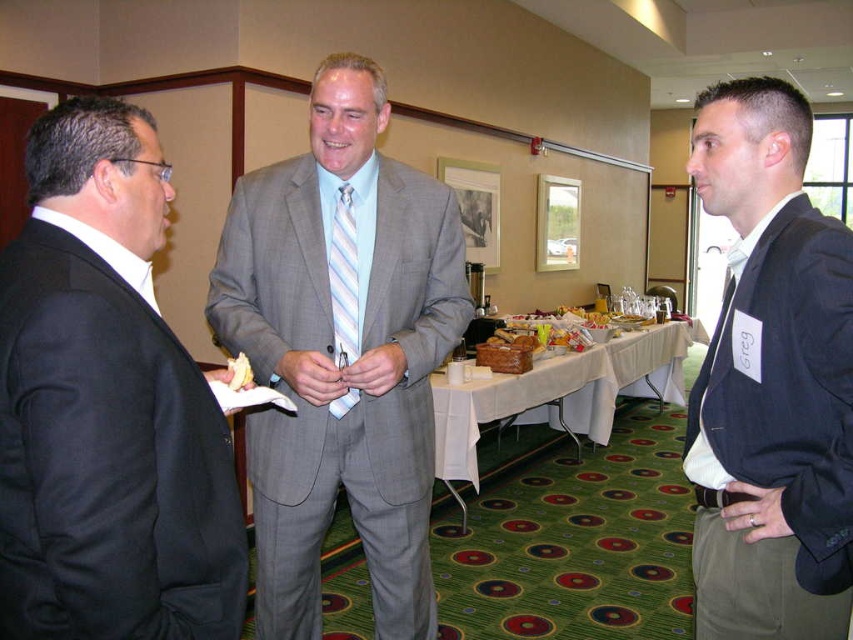
You are at a networking event and want to approach the two men wearing the gray textured suit at center and dark blue suit at right. Which one should you walk towards if you want to greet the man on the left side of the group?

You should walk towards the gray textured suit at center because it is positioned to the left of the dark blue suit at right, making it the left side of the group.

You are standing at the entrance of the conference room and see the black matte suit at left. If you want to move towards it, which direction should you walk relative to the room layout?

The black matte suit at left is located at point 0.636 on the x and 0.125 on the y axis. Since the entrance is typically at the lower left corner of the room, you should walk towards the right and slightly forward to reach it.